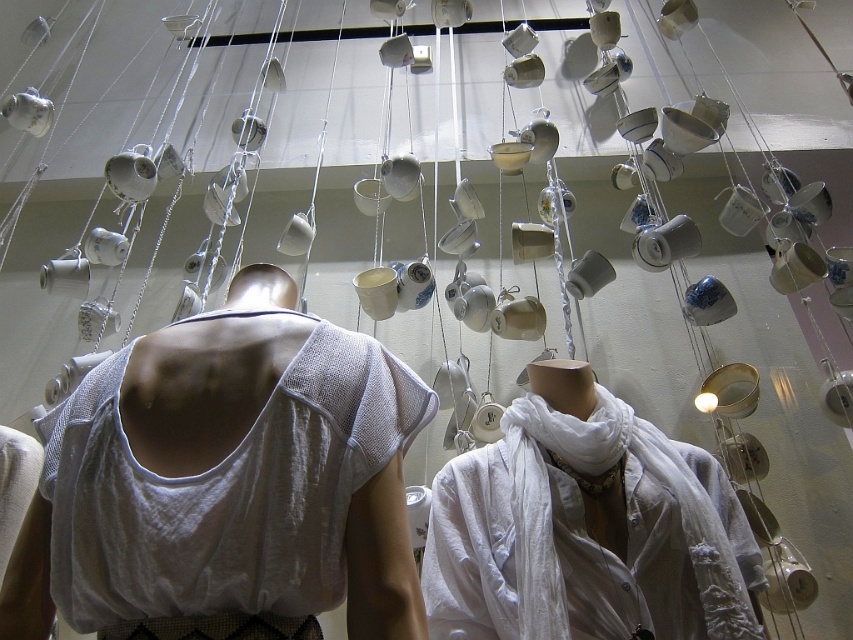
You are an artist trying to photograph the white mesh tank top at center and the white cotton scarf at center from a position where both are visible. Which item will appear larger in the photo?

The white mesh tank top at center will appear larger in the photo because it is closer to the viewer than the white cotton scarf at center.

You are an artist planning to add a new element to the installation. You have a small decorative pin that you want to attach to either the white mesh tank top at center or the white cotton scarf at center. Considering their positions, which item is more accessible for attaching the pin without disturbing the hanging cups?

The white cotton scarf at center is more accessible because it is located below the white mesh tank top at center, making it easier to reach without interfering with the suspended cups.